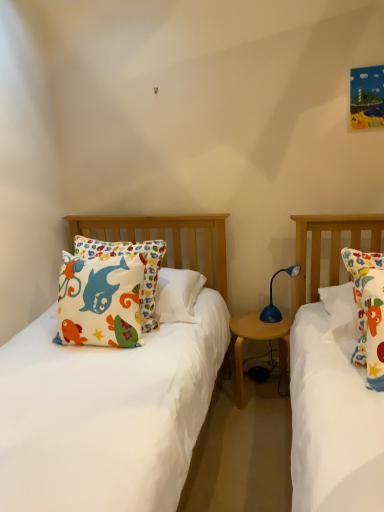
Describe the element at coordinates (272, 297) in the screenshot. I see `blue plastic lamp at center` at that location.

In order to click on blue plastic lamp at center in this screenshot , I will do `click(272, 297)`.

The height and width of the screenshot is (512, 384). What do you see at coordinates (259, 340) in the screenshot? I see `wooden round table at center` at bounding box center [259, 340].

The width and height of the screenshot is (384, 512). What are the coordinates of `wooden round table at center` in the screenshot? It's located at (259, 340).

This screenshot has height=512, width=384. Find the location of `blue plastic lamp at center`. blue plastic lamp at center is located at coordinates (272, 297).

Considering the positions of objects blue plastic lamp at center and wooden round table at center in the image provided, who is more to the right, blue plastic lamp at center or wooden round table at center?

Positioned to the right is blue plastic lamp at center.

Between blue plastic lamp at center and wooden round table at center, which one is positioned behind?

wooden round table at center is behind.

Which is in front, point (270, 291) or point (234, 365)?

The point (270, 291) is closer to the camera.

From the image's perspective, between blue plastic lamp at center and wooden round table at center, who is located below?

wooden round table at center.

From a real-world perspective, which object stands above the other?

In real-world perspective, blue plastic lamp at center is above.

Is blue plastic lamp at center thinner than wooden round table at center?

Correct, the width of blue plastic lamp at center is less than that of wooden round table at center.

Considering the sizes of objects blue plastic lamp at center and wooden round table at center in the image provided, who is taller, blue plastic lamp at center or wooden round table at center?

wooden round table at center is taller.

Looking at the image, does blue plastic lamp at center seem bigger or smaller compared to wooden round table at center?

blue plastic lamp at center is smaller than wooden round table at center.

Is blue plastic lamp at center inside or outside of wooden round table at center?

blue plastic lamp at center cannot be found inside wooden round table at center.

Would you consider blue plastic lamp at center to be distant from wooden round table at center?

blue plastic lamp at center is near wooden round table at center, not far away.

Could you tell me if blue plastic lamp at center is turned towards wooden round table at center?

No, blue plastic lamp at center is not oriented towards wooden round table at center.

How many degrees apart are the facing directions of blue plastic lamp at center and wooden round table at center?

The angle between the facing direction of blue plastic lamp at center and the facing direction of wooden round table at center is 52.2 degrees.

Identify the location of nightstand located below the blue plastic lamp at center (from the image's perspective). pyautogui.click(x=259, y=340).

Is wooden round table at center to the left or to the right of blue plastic lamp at center in the image?

From the image, it's evident that wooden round table at center is to the left of blue plastic lamp at center.

In the image, is wooden round table at center positioned in front of or behind blue plastic lamp at center?

wooden round table at center is behind blue plastic lamp at center.

Considering the positions of point (282, 326) and point (274, 316), is point (282, 326) closer or farther from the camera than point (274, 316)?

Clearly, point (282, 326) is closer to the camera than point (274, 316).

From the image's perspective, is wooden round table at center beneath blue plastic lamp at center?

Indeed, from the image's perspective, wooden round table at center is shown beneath blue plastic lamp at center.

From a real-world perspective, is wooden round table at center positioned above or below blue plastic lamp at center?

wooden round table at center is situated lower than blue plastic lamp at center in the real world.

Considering the sizes of objects wooden round table at center and blue plastic lamp at center in the image provided, who is wider, wooden round table at center or blue plastic lamp at center?

wooden round table at center.

From their relative heights in the image, would you say wooden round table at center is taller or shorter than blue plastic lamp at center?

Clearly, wooden round table at center is taller compared to blue plastic lamp at center.

Does wooden round table at center have a larger size compared to blue plastic lamp at center?

Yes, wooden round table at center is bigger than blue plastic lamp at center.

Is wooden round table at center outside of blue plastic lamp at center?

wooden round table at center is positioned outside blue plastic lamp at center.

Are wooden round table at center and blue plastic lamp at center making contact?

No, wooden round table at center is not beside blue plastic lamp at center.

Is wooden round table at center aimed at blue plastic lamp at center?

No, wooden round table at center is not oriented towards blue plastic lamp at center.

How distant is wooden round table at center from blue plastic lamp at center?

7.48 inches.

Image resolution: width=384 pixels, height=512 pixels. I want to click on lamp above the wooden round table at center (from a real-world perspective), so click(272, 297).

The height and width of the screenshot is (512, 384). In order to click on nightstand that appears on the left of blue plastic lamp at center in this screenshot , I will do `click(259, 340)`.

Where is `lamp in front of the wooden round table at center`? This screenshot has width=384, height=512. lamp in front of the wooden round table at center is located at coordinates (272, 297).